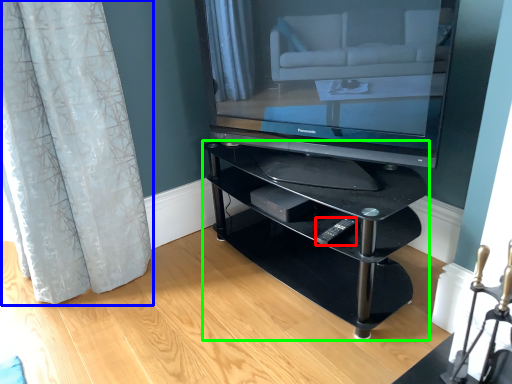
Question: Which is nearer to the remote (highlighted by a red box)? curtain (highlighted by a blue box) or shelf (highlighted by a green box).

Choices:
 (A) curtain
 (B) shelf

Answer: (B)